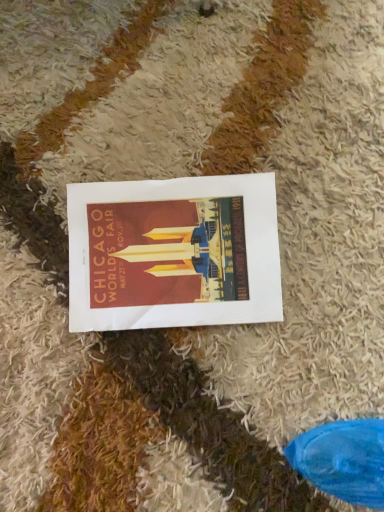
Find the location of `empty space that is ontop of matte paper poster at center (from a real-world perspective)`. empty space that is ontop of matte paper poster at center (from a real-world perspective) is located at coordinates (183, 247).